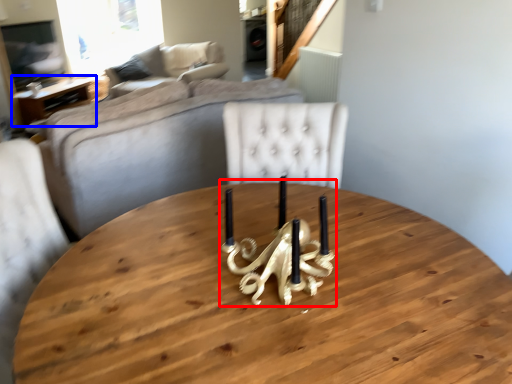
Question: Among these objects, which one is nearest to the camera, candle holder (highlighted by a red box) or table (highlighted by a blue box)?

Choices:
 (A) candle holder
 (B) table

Answer: (A)